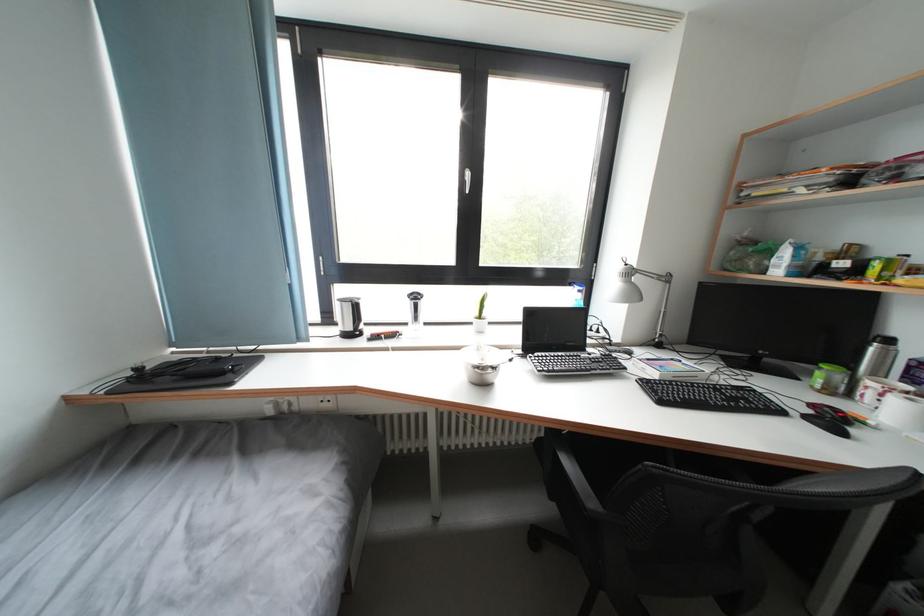
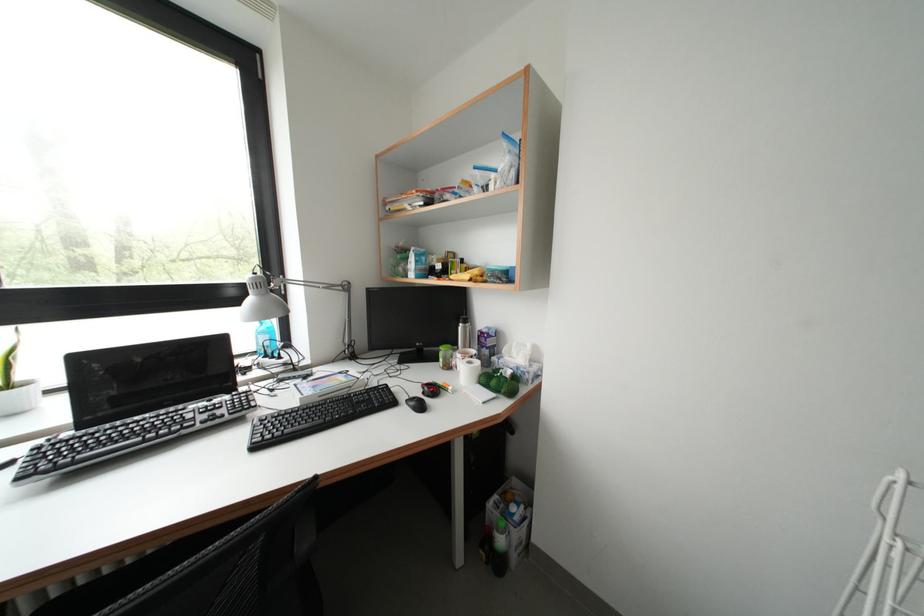
Question: How did the camera likely rotate?

Choices:
 (A) Left
 (B) Right
 (C) Up
 (D) Down

Answer: (B)